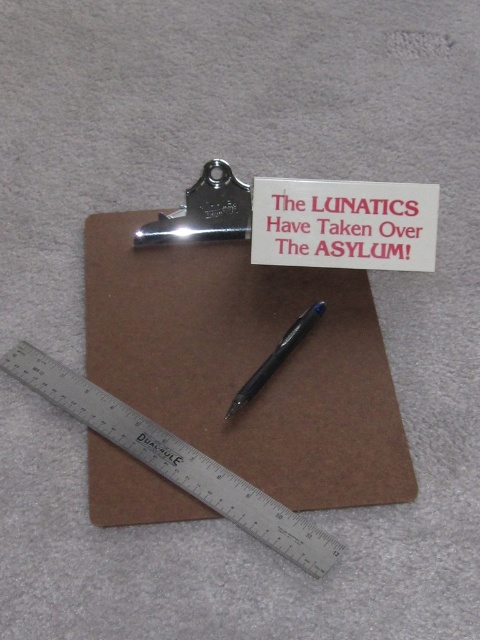
Question: Is brown cardboard clipboard at center thinner than brushed metal ruler at lower left?

Choices:
 (A) yes
 (B) no

Answer: (B)

Question: Which point is closer to the camera?

Choices:
 (A) red paper sign at center
 (B) silver metallic ruler at lower left
 (C) black plastic pen at center

Answer: (B)

Question: Which is farther from the black plastic pen at center?

Choices:
 (A) silver metallic ruler at lower left
 (B) red paper sign at center
 (C) brown cardboard clipboard at center

Answer: (A)

Question: Does silver metallic ruler at lower left have a smaller size compared to red paper sign at center?

Choices:
 (A) no
 (B) yes

Answer: (A)

Question: Does red paper sign at center have a lesser width compared to brushed metal ruler at lower left?

Choices:
 (A) yes
 (B) no

Answer: (B)

Question: Among these points, which one is farthest from the camera?

Choices:
 (A) tap(286, 538)
 (B) tap(254, 476)

Answer: (B)